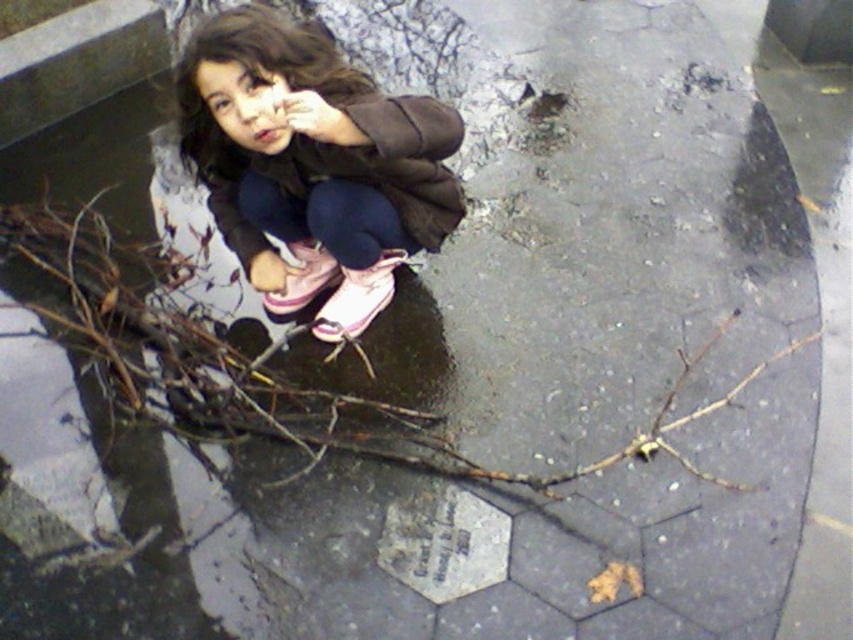
Question: Which object appears farthest from the camera in this image?

Choices:
 (A) matte brown jacket at upper center
 (B) brown wood branch at center

Answer: (B)

Question: Can you confirm if matte brown jacket at upper center is positioned to the left of brown wood branch at center?

Choices:
 (A) no
 (B) yes

Answer: (B)

Question: From the image, what is the correct spatial relationship of matte brown jacket at upper center in relation to brown wood branch at center?

Choices:
 (A) above
 (B) below

Answer: (A)

Question: Is matte brown jacket at upper center closer to camera compared to brown wood branch at center?

Choices:
 (A) yes
 (B) no

Answer: (A)

Question: Which point is farther from the camera taking this photo?

Choices:
 (A) (409, 410)
 (B) (360, 284)

Answer: (B)